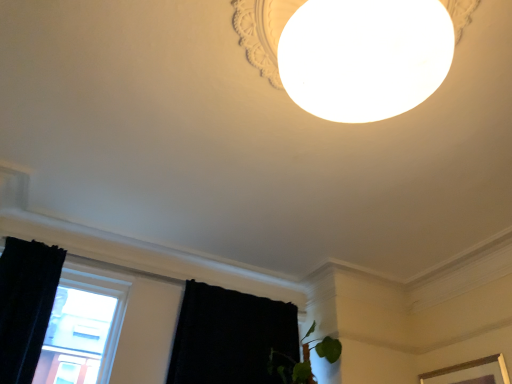
Question: Choose the correct answer: Is transparent glass window at lower left inside black fabric curtain at lower left, the 1th curtain when ordered from right to left, or outside it?

Choices:
 (A) outside
 (B) inside

Answer: (A)

Question: Considering their positions, is transparent glass window at lower left located in front of or behind black fabric curtain at lower left, the 1th curtain when ordered from right to left?

Choices:
 (A) behind
 (B) front

Answer: (B)

Question: Estimate the real-world distances between objects in this image. Which object is farther from the transparent glass window at lower left?

Choices:
 (A) black fabric curtain at lower left, the 1th curtain when ordered from right to left
 (B) black velvet curtain at left, the first curtain from the left

Answer: (A)

Question: Which of these objects is positioned closest to the transparent glass window at lower left?

Choices:
 (A) black velvet curtain at left, which ranks as the second curtain in right-to-left order
 (B) black fabric curtain at lower left, the second curtain positioned from the left

Answer: (A)